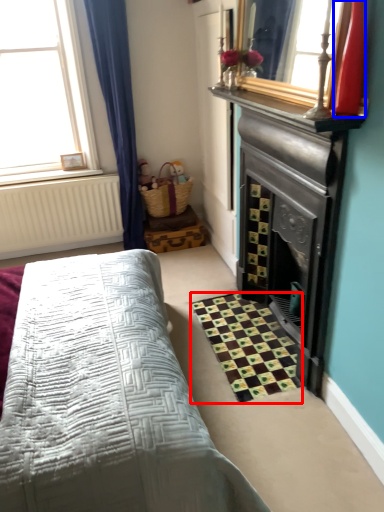
Question: Which point is closer to the camera, pattern (highlighted by a red box) or chiffonier (highlighted by a blue box)?

Choices:
 (A) pattern
 (B) chiffonier

Answer: (B)